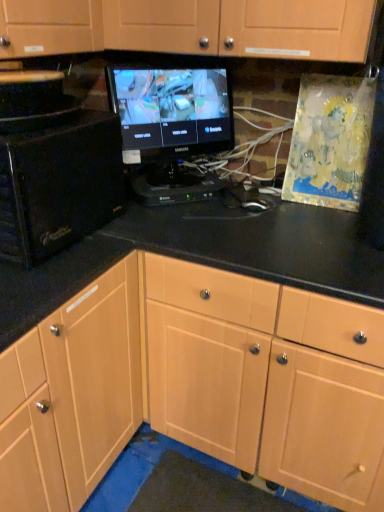
The image size is (384, 512). What do you see at coordinates (208, 379) in the screenshot? I see `light wood cabinet at center` at bounding box center [208, 379].

The width and height of the screenshot is (384, 512). Find the location of `light wood cabinet at center`. light wood cabinet at center is located at coordinates [x=208, y=379].

The image size is (384, 512). In order to click on light wood cabinet at center in this screenshot , I will do point(208,379).

Between point (60, 172) and point (380, 477), which one is positioned behind?

The point (380, 477) is farther.

From their relative heights in the image, would you say black glossy microwave at left is taller or shorter than light wood cabinet at center?

In the image, black glossy microwave at left appears to be shorter than light wood cabinet at center.

Would you say black glossy microwave at left is to the left or to the right of light wood cabinet at center in the picture?

Based on their positions, black glossy microwave at left is located to the left of light wood cabinet at center.

The width and height of the screenshot is (384, 512). I want to click on cabinetry in front of the black glossy microwave at left, so click(x=208, y=379).

Is point (300, 364) in front of point (6, 176)?

No, it is behind (6, 176).

From the image's perspective, does light wood cabinet at center appear lower than black glossy microwave at left?

Correct, light wood cabinet at center appears lower than black glossy microwave at left in the image.

Identify the location of cabinetry below the black glossy microwave at left (from the image's perspective). (208, 379).

Is light wood cabinet at center spatially inside black glossy microwave at left, or outside of it?

light wood cabinet at center lies outside black glossy microwave at left.

Does black glossy monitor at center lie in front of black glossy microwave at left?

No, black glossy monitor at center is behind black glossy microwave at left.

Considering the positions of points (186, 95) and (37, 172), is point (186, 95) farther from camera compared to point (37, 172)?

Yes, it is.

Considering the sizes of objects black glossy monitor at center and black glossy microwave at left in the image provided, who is shorter, black glossy monitor at center or black glossy microwave at left?

Standing shorter between the two is black glossy microwave at left.

Is black glossy monitor at center at the left side of black glossy microwave at left?

In fact, black glossy monitor at center is to the right of black glossy microwave at left.

Does black glossy microwave at left contain black glossy monitor at center?

No, black glossy monitor at center is not a part of black glossy microwave at left.

Is black glossy microwave at left not near black glossy monitor at center?

black glossy microwave at left is actually quite close to black glossy monitor at center.

From a real-world perspective, is black glossy microwave at left over black glossy monitor at center?

No, from a real-world perspective, black glossy microwave at left is not above black glossy monitor at center.

Considering the sizes of objects black glossy microwave at left and black glossy monitor at center in the image provided, who is shorter, black glossy microwave at left or black glossy monitor at center?

black glossy microwave at left.

Is the surface of black glossy monitor at center in direct contact with light wood cabinet at center?

There is a gap between black glossy monitor at center and light wood cabinet at center.

Could light wood cabinet at center be considered to be inside black glossy monitor at center?

No, light wood cabinet at center is located outside of black glossy monitor at center.

In the image, there is a black glossy monitor at center. Where is `cabinetry below it (from the image's perspective)`? Image resolution: width=384 pixels, height=512 pixels. cabinetry below it (from the image's perspective) is located at coordinates (208, 379).

Is point (134, 89) less distant than point (142, 302)?

No, (134, 89) is further to viewer.

Would you say light wood cabinet at center is to the left or to the right of black glossy monitor at center in the picture?

From the image, it's evident that light wood cabinet at center is to the right of black glossy monitor at center.

Looking at their sizes, would you say light wood cabinet at center is wider or thinner than black glossy monitor at center?

light wood cabinet at center is wider than black glossy monitor at center.

From the image's perspective, is light wood cabinet at center located beneath black glossy monitor at center?

Indeed, from the image's perspective, light wood cabinet at center is shown beneath black glossy monitor at center.

At what (x,y) coordinates should I click in order to perform the action: click on desktop computer above the light wood cabinet at center (from the image's perspective). Please return your answer as a coordinate pair (x, y). The height and width of the screenshot is (512, 384). Looking at the image, I should click on (57, 181).

Where is `cabinetry below the black glossy microwave at left (from a real-world perspective)`? cabinetry below the black glossy microwave at left (from a real-world perspective) is located at coordinates (208, 379).

Estimate the real-world distances between objects in this image. Which object is further from light wood cabinet at center, black glossy microwave at left or black glossy monitor at center?

The object further to light wood cabinet at center is black glossy monitor at center.

Which object lies further to the anchor point black glossy monitor at center, light wood cabinet at center or black glossy microwave at left?

Based on the image, light wood cabinet at center appears to be further to black glossy monitor at center.

When comparing their distances from black glossy microwave at left, does light wood cabinet at center or black glossy monitor at center seem further?

light wood cabinet at center is further to black glossy microwave at left.

When comparing their distances from light wood cabinet at center, does black glossy monitor at center or black glossy microwave at left seem closer?

black glossy microwave at left is positioned closer to the anchor light wood cabinet at center.

From the image, which object appears to be nearer to black glossy microwave at left, black glossy monitor at center or light wood cabinet at center?

Among the two, black glossy monitor at center is located nearer to black glossy microwave at left.

Considering their positions, is black glossy microwave at left positioned further to black glossy monitor at center than light wood cabinet at center?

light wood cabinet at center.

Locate an element on the screen. Image resolution: width=384 pixels, height=512 pixels. computer monitor between black glossy microwave at left and light wood cabinet at center is located at coordinates (171, 121).